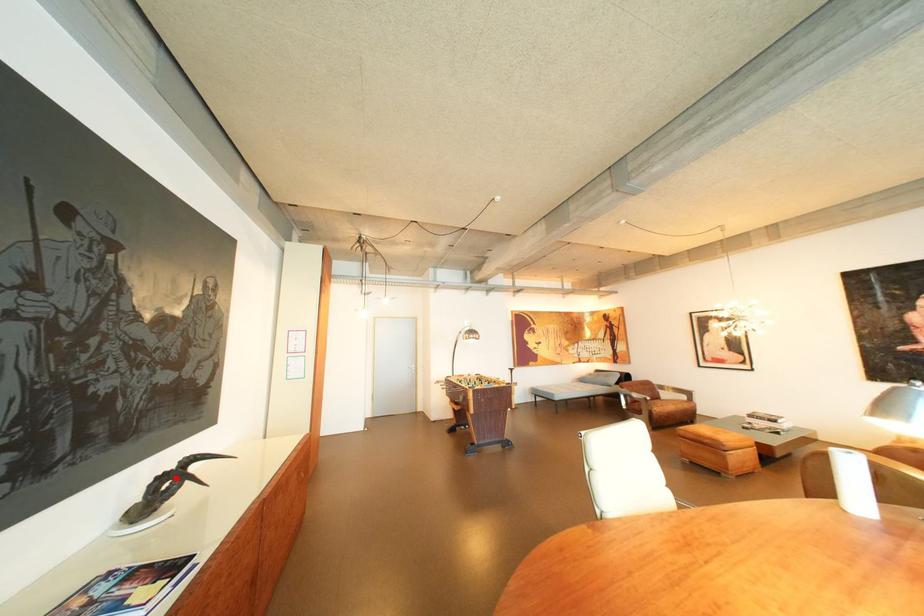
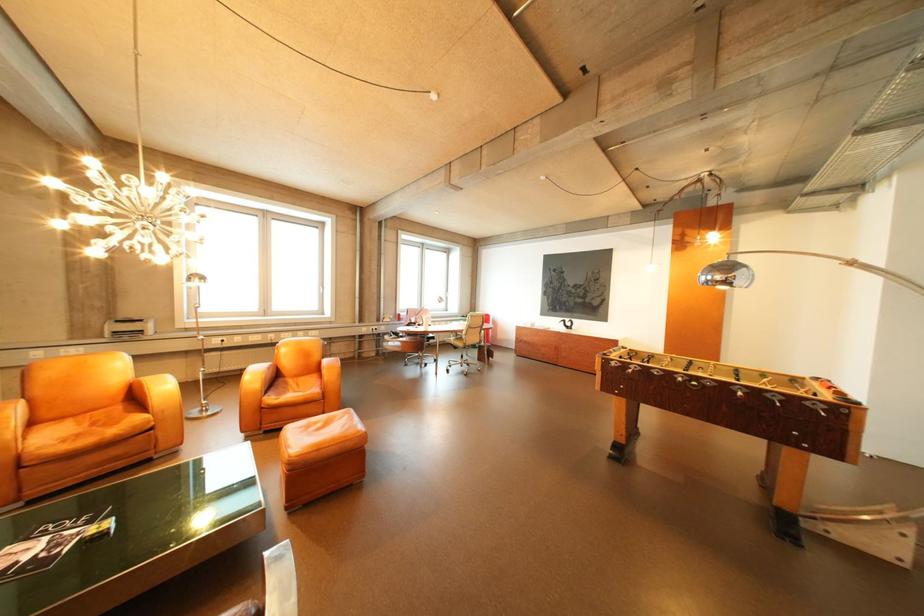
Question: I am providing you with two images of the same scene from different viewpoints. A red point is shown in image1. For the corresponding object point in image2, is it positioned nearer or farther from the camera?

Choices:
 (A) Nearer
 (B) Farther

Answer: (B)